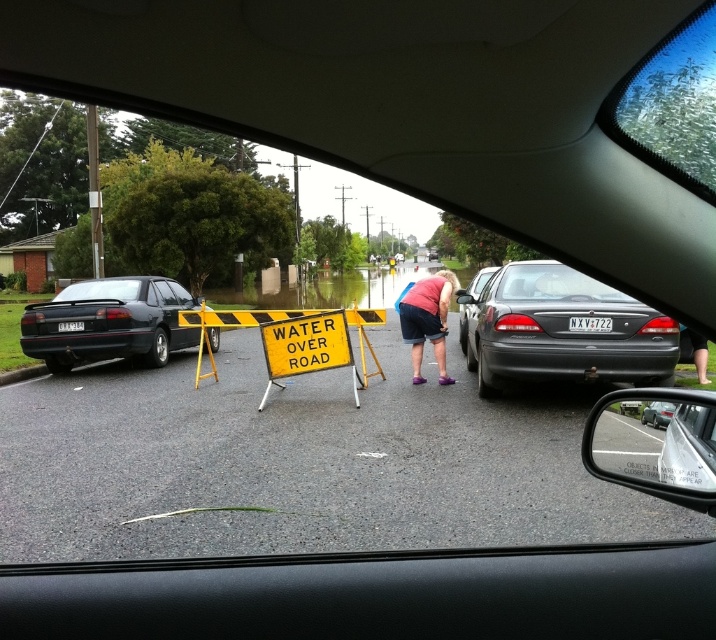
Based on the photo, you are driving a car and see the yellow plastic sign at center ahead. Your car is 4.5 meters long. Can you safely stop before reaching the sign?

The yellow plastic sign at center is 7.58 meters away from viewer. Since your car is 4.5 meters long, you have enough distance to safely stop before reaching the sign.

You are driving a car that is 4.5 meters long. You need to pass through the flooded area between the yellow plastic sign at center and the matte black sedan at center. Can your car fit through the space between them?

The space between the yellow plastic sign at center and the matte black sedan at center is 5.90 meters. Since your car is 4.5 meters long, it can fit through the space as there is enough room.

You are a driver trying to navigate through a flooded area. You see the yellow plastic sign at center and the matte black sedan at center ahead. Which object is closer to the left side of the road?

The yellow plastic sign at center is positioned on the left side of matte black sedan at center, so the yellow plastic sign at center is closer to the left side of the road.